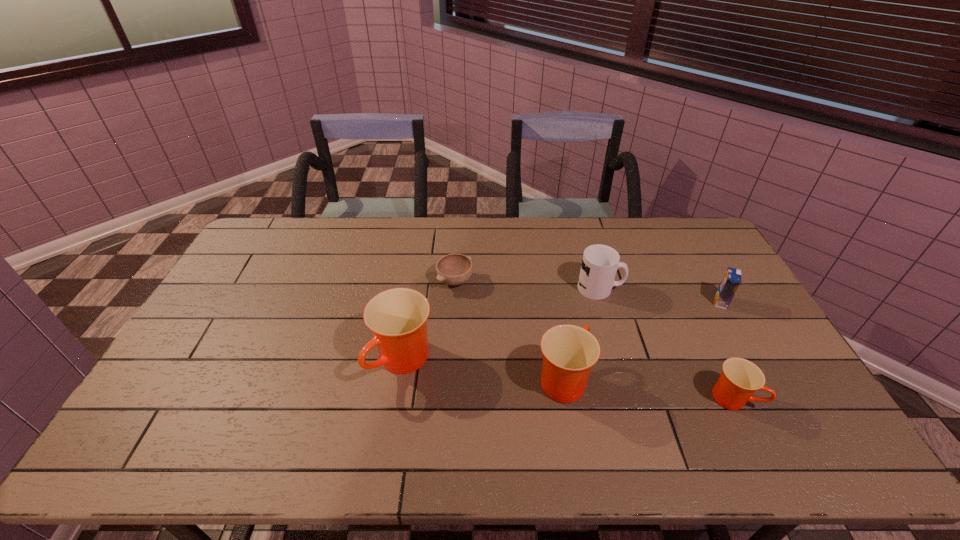
Find the location of a particular element. The image size is (960, 540). vacant point at the far left corner is located at coordinates point(275,248).

Find the location of a particular element. free space at the far right corner of the desktop is located at coordinates (695, 233).

Where is `vacant point located between the second tallest cup and the orange_juice`? The width and height of the screenshot is (960, 540). vacant point located between the second tallest cup and the orange_juice is located at coordinates (641, 340).

Find the location of a particular element. The height and width of the screenshot is (540, 960). free point between the second cup from right to left and the shortest object is located at coordinates (509, 330).

Image resolution: width=960 pixels, height=540 pixels. I want to click on free spot between the second shortest cup and the orange_juice, so click(x=641, y=340).

You are a GUI agent. You are given a task and a screenshot of the screen. Output one action in this format:
    pyautogui.click(x=<x>, y=<y>)
    Task: Click on the vacant region between the mug and the second object from right to left
    
    Given the screenshot: What is the action you would take?
    pyautogui.click(x=666, y=343)

Locate an element on the screen. The height and width of the screenshot is (540, 960). free space between the mug and the leftmost cup is located at coordinates (502, 325).

The image size is (960, 540). In order to click on free space that is in between the second object from right to left and the orange_juice in this screenshot , I will do [x=727, y=350].

In order to click on free area in between the leftmost cup and the second tallest cup in this screenshot , I will do `click(483, 370)`.

This screenshot has height=540, width=960. Find the location of `vacant area that lies between the third object from right to left and the shortest cup`. vacant area that lies between the third object from right to left and the shortest cup is located at coordinates (666, 343).